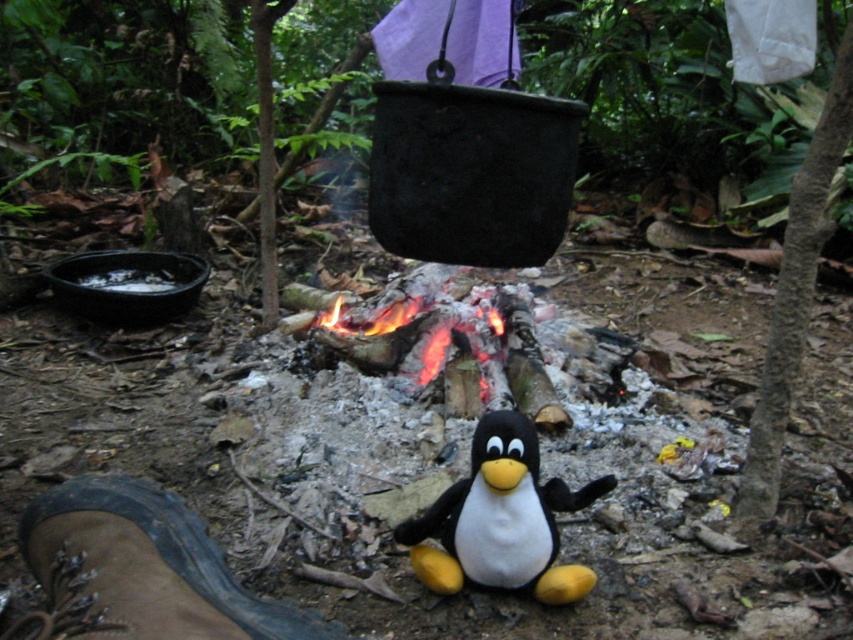
Question: From the image, what is the correct spatial relationship of black plush penguin at center in relation to brown leather boot at lower left?

Choices:
 (A) left
 (B) right

Answer: (B)

Question: Which point is closer to the camera?

Choices:
 (A) (318, 632)
 (B) (519, 497)

Answer: (A)

Question: Which point is farther to the camera?

Choices:
 (A) (555, 545)
 (B) (328, 634)

Answer: (A)

Question: Does black plush penguin at center have a greater width compared to brown leather boot at lower left?

Choices:
 (A) yes
 (B) no

Answer: (B)

Question: Is black plush penguin at center further to the viewer compared to brown leather boot at lower left?

Choices:
 (A) no
 (B) yes

Answer: (B)